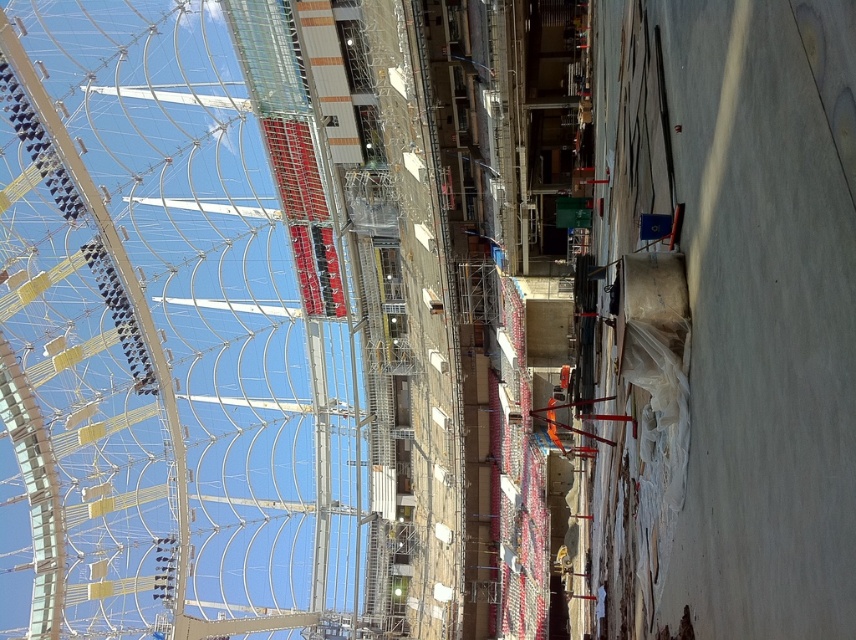
You are a construction worker who needs to move a heavy beam from the metallic scaffolding at upper center to the concrete slab at right. Based on their positions, which direction should you move the beam to place it correctly?

You should move the beam to the right since the metallic scaffolding at upper center is to the left of the concrete slab at right.

You are an inspector checking the construction site. You notice the metallic scaffolding at upper center and the concrete slab at right. Which one is positioned lower in the scene?

The metallic scaffolding at upper center is positioned lower than the concrete slab at right because it is below it.